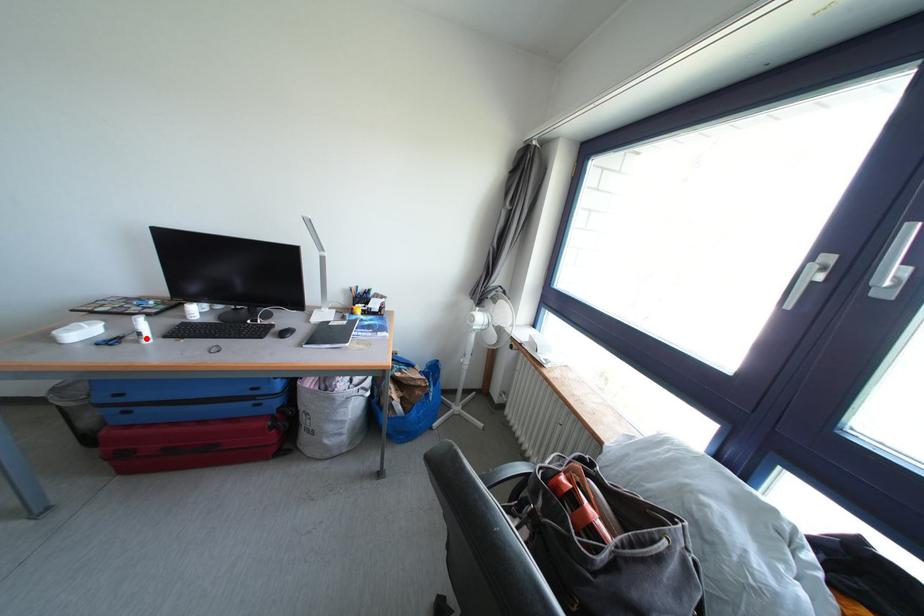
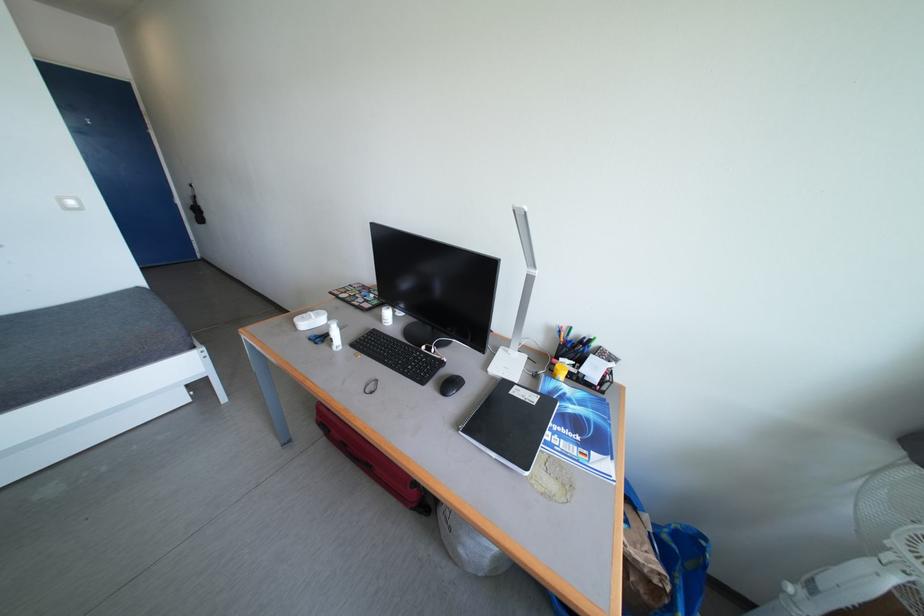
Question: I am providing you with two images of the same scene from different viewpoints. A red point is marked on the first image. At the location where the point appears in image 1, is it still visible in image 2?

Choices:
 (A) Yes
 (B) No

Answer: (B)